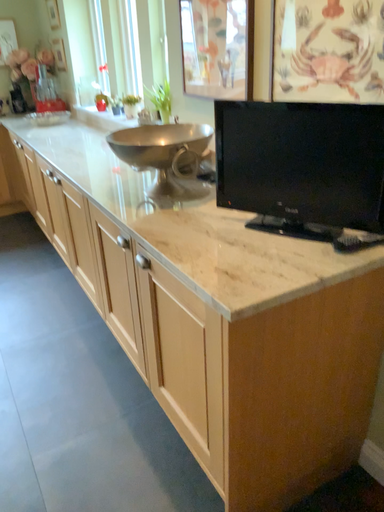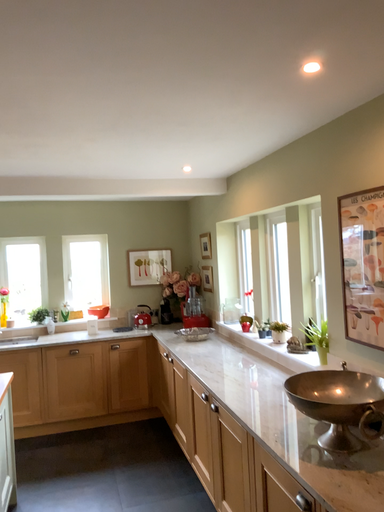
Question: How did the camera likely rotate when shooting the video?

Choices:
 (A) rotated right
 (B) rotated left

Answer: (B)